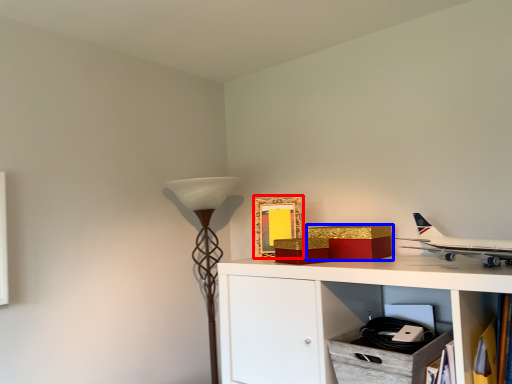
Question: Which point is further to the camera, picture frame (highlighted by a red box) or box (highlighted by a blue box)?

Choices:
 (A) picture frame
 (B) box

Answer: (A)